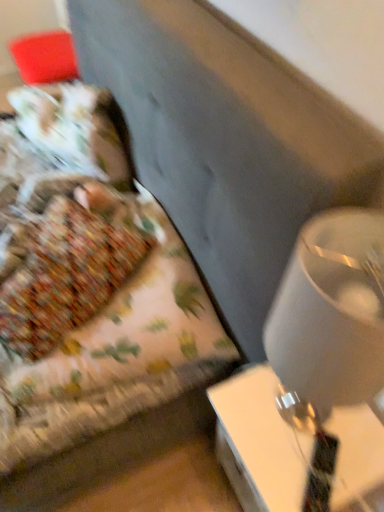
Question: Is white glossy lampshade at right inside the boundaries of white glossy table at lower right, or outside?

Choices:
 (A) outside
 (B) inside

Answer: (A)

Question: Considering the relative positions of white glossy lampshade at right and white glossy table at lower right in the image provided, is white glossy lampshade at right to the left or to the right of white glossy table at lower right?

Choices:
 (A) right
 (B) left

Answer: (B)

Question: Which of these objects is positioned farthest from the floral fabric bed at left?

Choices:
 (A) white glossy table at lower right
 (B) white glossy lampshade at right

Answer: (B)

Question: Estimate the real-world distances between objects in this image. Which object is closer to the white glossy table at lower right?

Choices:
 (A) white glossy lampshade at right
 (B) floral fabric bed at left

Answer: (A)